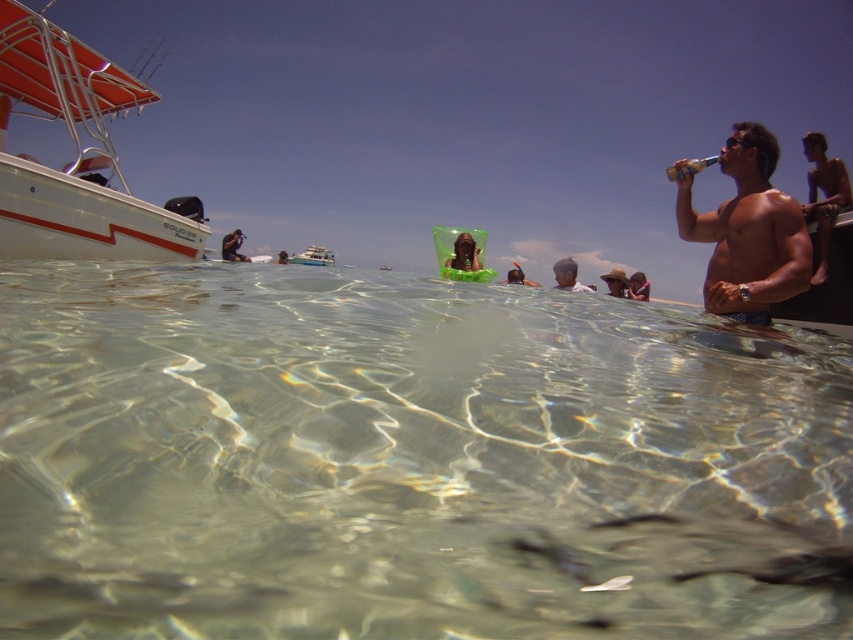
Question: In this image, where is shiny metallic torso at right located relative to white plastic boat at center?

Choices:
 (A) above
 (B) below

Answer: (B)

Question: Estimate the real-world distances between objects in this image. Which object is farther from the white glossy boat at upper left?

Choices:
 (A) smooth skin man at upper right
 (B) shiny metallic torso at right

Answer: (A)

Question: Which of the following is the closest to the observer?

Choices:
 (A) white plastic boat at center
 (B) shiny metallic tank top at upper right
 (C) translucent plastic bottle at upper right
 (D) smooth skin man at upper right

Answer: (C)

Question: Does clear water at center have a lesser width compared to white plastic boat at center?

Choices:
 (A) no
 (B) yes

Answer: (A)

Question: Among these objects, which one is nearest to the camera?

Choices:
 (A) clear water at center
 (B) smooth skin man at upper right
 (C) white plastic boat at center
 (D) shiny metallic tank top at upper right

Answer: (A)

Question: Does white glossy boat at upper left have a greater width compared to shiny metallic tank top at upper right?

Choices:
 (A) yes
 (B) no

Answer: (A)